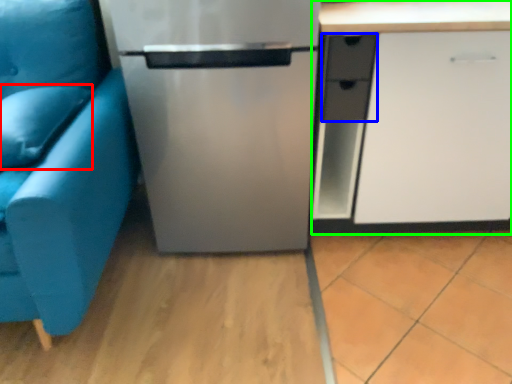
Question: Considering the real-world distances, which object is closest to pillow (highlighted by a red box)? drawer (highlighted by a blue box) or cabinetry (highlighted by a green box).

Choices:
 (A) drawer
 (B) cabinetry

Answer: (A)